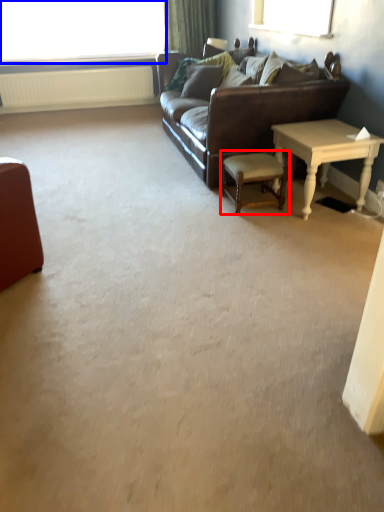
Question: Which of the following is the farthest to the observer, chair (highlighted by a red box) or window (highlighted by a blue box)?

Choices:
 (A) chair
 (B) window

Answer: (B)